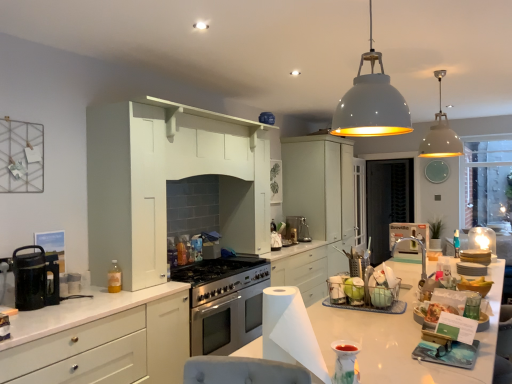
What is the approximate width of translucent glass candle at center, which is counted as the 6th appliance, starting from the left?

9.78 inches.

The width and height of the screenshot is (512, 384). What do you see at coordinates (482, 239) in the screenshot? I see `translucent glass candle at center, which is the second appliance from back to front` at bounding box center [482, 239].

This screenshot has height=384, width=512. Describe the element at coordinates (354, 288) in the screenshot. I see `green matte apple at center` at that location.

Where is `matte white plates at right, marked as the 2th appliance in a right-to-left arrangement`? matte white plates at right, marked as the 2th appliance in a right-to-left arrangement is located at coordinates (476, 256).

Considering the sizes of matte white cabinets at center, the second cabinetry in the front-to-back sequence, and translucent plastic bottle at left in the image, is matte white cabinets at center, the second cabinetry in the front-to-back sequence, wider or thinner than translucent plastic bottle at left?

Considering their sizes, matte white cabinets at center, the second cabinetry in the front-to-back sequence, looks broader than translucent plastic bottle at left.

Which is in front, matte white cabinets at center, acting as the 1th cabinetry starting from the right, or translucent plastic bottle at left?

translucent plastic bottle at left is closer to the camera.

Between point (330, 163) and point (113, 283), which one is positioned in front?

Positioned in front is point (113, 283).

Is black mesh screen door at center located within white matte pendant lamp at upper center, which ranks as the 1th light fixture in back-to-front order?

No, black mesh screen door at center is not a part of white matte pendant lamp at upper center, which ranks as the 1th light fixture in back-to-front order.

From a real-world perspective, is white matte pendant lamp at upper center, which ranks as the 1th light fixture in back-to-front order, beneath black mesh screen door at center?

No, from a real-world perspective, white matte pendant lamp at upper center, which ranks as the 1th light fixture in back-to-front order, is not beneath black mesh screen door at center.

Which object is closer to the camera taking this photo, white matte pendant lamp at upper center, positioned as the 2th light fixture in front-to-back order, or black mesh screen door at center?

white matte pendant lamp at upper center, positioned as the 2th light fixture in front-to-back order, is more forward.

Is translucent plastic bottle at left aimed at matte white cabinets at center, the second cabinetry in the front-to-back sequence?

No, translucent plastic bottle at left is not facing towards matte white cabinets at center, the second cabinetry in the front-to-back sequence.

Is translucent plastic bottle at left bigger than matte white cabinets at center, which is counted as the first cabinetry, starting from the back?

Actually, translucent plastic bottle at left might be smaller than matte white cabinets at center, which is counted as the first cabinetry, starting from the back.

Do you think translucent plastic bottle at left is within matte white cabinets at center, the second cabinetry in the front-to-back sequence, or outside of it?

translucent plastic bottle at left is not inside matte white cabinets at center, the second cabinetry in the front-to-back sequence, it's outside.

In the image, there is a matte white cabinets at center, positioned as the second cabinetry in left-to-right order. Where is `bottle below it (from a real-world perspective)`? This screenshot has height=384, width=512. bottle below it (from a real-world perspective) is located at coordinates (114, 278).

From the image's perspective, is black glass coffee maker at left over white matte cabinet at left, the 2th cabinetry in the right-to-left sequence?

Indeed, from the image's perspective, black glass coffee maker at left is shown above white matte cabinet at left, the 2th cabinetry in the right-to-left sequence.

Considering the relative positions of black glass coffee maker at left and white matte cabinet at left, which appears as the 1th cabinetry when viewed from the left, in the image provided, is black glass coffee maker at left to the right of white matte cabinet at left, which appears as the 1th cabinetry when viewed from the left, from the viewer's perspective?

Incorrect, black glass coffee maker at left is not on the right side of white matte cabinet at left, which appears as the 1th cabinetry when viewed from the left.

Is black glass coffee maker at left bigger or smaller than white matte cabinet at left, acting as the 2th cabinetry starting from the back?

black glass coffee maker at left is smaller than white matte cabinet at left, acting as the 2th cabinetry starting from the back.

Where is `kitchen appliance that is above the white matte cabinet at left, acting as the 1th cabinetry starting from the front (from the image's perspective)`? kitchen appliance that is above the white matte cabinet at left, acting as the 1th cabinetry starting from the front (from the image's perspective) is located at coordinates (35, 278).

Does white matte stack of plates at right, the 4th appliance positioned from the back, come behind translucent glass candle at center, which is counted as the 6th appliance, starting from the left?

No, white matte stack of plates at right, the 4th appliance positioned from the back, is closer to the camera.

From a real-world perspective, is white matte stack of plates at right, placed as the fourth appliance when sorted from left to right, on top of translucent glass candle at center, which is the second appliance from back to front?

No, from a real-world perspective, white matte stack of plates at right, placed as the fourth appliance when sorted from left to right, is not over translucent glass candle at center, which is the second appliance from back to front

Measure the distance between white matte stack of plates at right, placed as the fourth appliance when sorted from left to right, and translucent glass candle at center, marked as the first appliance in a right-to-left arrangement.

They are 41.27 centimeters apart.

Is white matte stack of plates at right, the 4th appliance positioned from the back, wider or thinner than translucent glass candle at center, the 5th appliance in the front-to-back sequence?

Considering their sizes, white matte stack of plates at right, the 4th appliance positioned from the back, looks slimmer than translucent glass candle at center, the 5th appliance in the front-to-back sequence.

From the image's perspective, which appliance is the 1st one above the green matte apple at center? Please provide its 2D coordinates.

[(482, 239)]

Consider the image. Which object is positioned more to the right, translucent glass candle at center, which is counted as the 6th appliance, starting from the left, or green matte apple at center?

From the viewer's perspective, translucent glass candle at center, which is counted as the 6th appliance, starting from the left, appears more on the right side.

From the image's perspective, which object appears higher, translucent glass candle at center, which is the second appliance from back to front, or green matte apple at center?

translucent glass candle at center, which is the second appliance from back to front, appears higher in the image.

Considering the relative sizes of matte white container at center, which is the 2th appliance in left-to-right order, and white glossy dome at upper center, the second light fixture positioned from the back, in the image provided, is matte white container at center, which is the 2th appliance in left-to-right order, taller than white glossy dome at upper center, the second light fixture positioned from the back,?

In fact, matte white container at center, which is the 2th appliance in left-to-right order, may be shorter than white glossy dome at upper center, the second light fixture positioned from the back.

In the scene shown: Which of these two, matte white container at center, which is the 2th appliance in left-to-right order, or white glossy dome at upper center, the 1th light fixture in the left-to-right sequence, is bigger?

Bigger between the two is white glossy dome at upper center, the 1th light fixture in the left-to-right sequence.

Considering the relative sizes of matte white container at center, the 5th appliance when ordered from right to left, and white glossy dome at upper center, acting as the second light fixture starting from the right, in the image provided, is matte white container at center, the 5th appliance when ordered from right to left, thinner than white glossy dome at upper center, acting as the second light fixture starting from the right,?

Correct, the width of matte white container at center, the 5th appliance when ordered from right to left, is less than that of white glossy dome at upper center, acting as the second light fixture starting from the right.

Considering the positions of objects matte white container at center, which is the 2th appliance in left-to-right order, and white glossy dome at upper center, which is the 1th light fixture from front to back, in the image provided, who is behind, matte white container at center, which is the 2th appliance in left-to-right order, or white glossy dome at upper center, which is the 1th light fixture from front to back,?

matte white container at center, which is the 2th appliance in left-to-right order, is behind.

The height and width of the screenshot is (384, 512). Identify the location of bottle in front of the matte white cabinets at center, the second cabinetry in the front-to-back sequence. (114, 278).

Identify the location of the 2nd light fixture positioned above the black mesh screen door at center (from a real-world perspective). The width and height of the screenshot is (512, 384). (440, 134).

Consider the image. Which object lies further to the anchor point white matte pendant lamp at upper center, which ranks as the 1th light fixture in back-to-front order, white matte cabinet at left, acting as the 2th cabinetry starting from the back, or black mesh screen door at center?

white matte cabinet at left, acting as the 2th cabinetry starting from the back.

Which object lies nearer to the anchor point matte white container at center, which is the 2th appliance from front to back, white paper at center or white matte stack of plates at right, placed as the fourth appliance when sorted from left to right?

Based on the image, white paper at center appears to be nearer to matte white container at center, which is the 2th appliance from front to back.

Considering their positions, is clear glass cabinet at center positioned closer to white glossy dome at upper center, which is the 1th light fixture from front to back, than matte white cabinets at center, which is counted as the first cabinetry, starting from the back?

The object closer to white glossy dome at upper center, which is the 1th light fixture from front to back, is matte white cabinets at center, which is counted as the first cabinetry, starting from the back.

Which object lies further to the anchor point translucent glass candle at center, which is counted as the 6th appliance, starting from the left, matte white plates at right, which appears as the 5th appliance when viewed from the left, or matte white container at center, the 5th appliance positioned from the back?

Based on the image, matte white container at center, the 5th appliance positioned from the back, appears to be further to translucent glass candle at center, which is counted as the 6th appliance, starting from the left.

Based on their spatial positions, is white matte stack of plates at right, placed as the fourth appliance when sorted from left to right, or satin silver kettle at center, which is counted as the third appliance, starting from the left, further from matte white container at center, the 5th appliance when ordered from right to left?

Among the two, satin silver kettle at center, which is counted as the third appliance, starting from the left, is located further to matte white container at center, the 5th appliance when ordered from right to left.

Looking at the image, which one is located further to satin silver kettle at center, marked as the 6th appliance in a front-to-back arrangement, white matte pendant lamp at upper center, which ranks as the 1th light fixture in back-to-front order, or translucent plastic bottle at left?

translucent plastic bottle at left is positioned further to the anchor satin silver kettle at center, marked as the 6th appliance in a front-to-back arrangement.

Looking at the image, which one is located closer to white paper at center, black glass coffee maker at left or black mesh screen door at center?

black glass coffee maker at left.

Looking at the image, which one is located further to translucent glass candle at center, which is counted as the 6th appliance, starting from the left, white matte pendant lamp at upper center, marked as the first light fixture in a right-to-left arrangement, or black mesh screen door at center?

Among the two, black mesh screen door at center is located further to translucent glass candle at center, which is counted as the 6th appliance, starting from the left.

This screenshot has width=512, height=384. Find the location of `bottle between white paper at center and matte white cabinets at center, which is counted as the first cabinetry, starting from the back, along the z-axis`. bottle between white paper at center and matte white cabinets at center, which is counted as the first cabinetry, starting from the back, along the z-axis is located at coordinates coord(114,278).

Identify the location of bottle between black glass coffee maker at left and clear glass window at right from left to right. This screenshot has width=512, height=384. (114, 278).

Find the location of a particular element. The height and width of the screenshot is (384, 512). window screen between matte white container at center, the 5th appliance when ordered from right to left, and clear glass cabinet at center, along the z-axis is located at coordinates (486, 180).

Where is `food located between white matte cabinet at left, the 2th cabinetry in the right-to-left sequence, and clear glass window at right in the depth direction`? This screenshot has height=384, width=512. food located between white matte cabinet at left, the 2th cabinetry in the right-to-left sequence, and clear glass window at right in the depth direction is located at coordinates (354, 288).